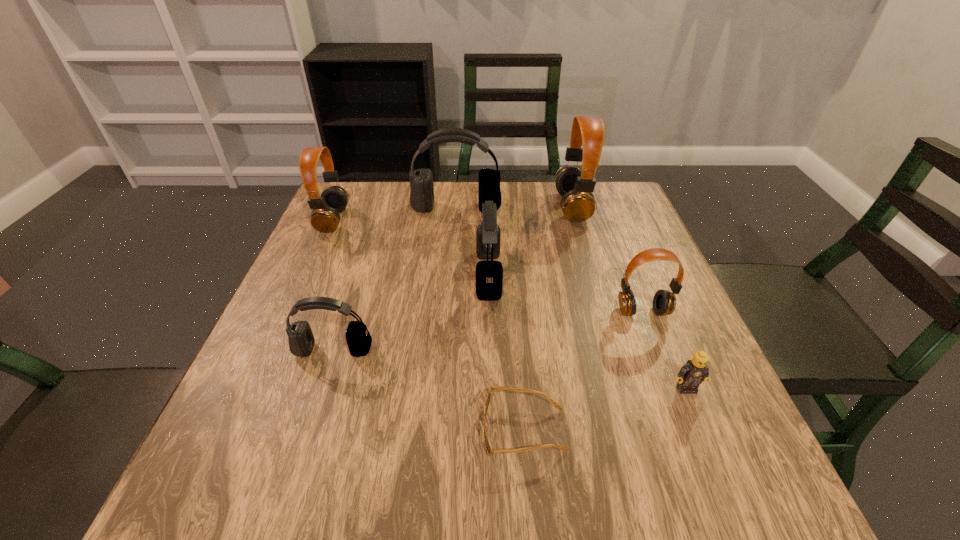
Locate an element on the screen. The height and width of the screenshot is (540, 960). free space at the far edge is located at coordinates (510, 187).

In the image, there is a desktop. Where is `blank space at the near edge`? blank space at the near edge is located at coordinates (574, 509).

In the image, there is a desktop. Find the location of `free space at the left edge`. free space at the left edge is located at coordinates (297, 279).

Locate an element on the screen. This screenshot has height=540, width=960. free region at the right edge is located at coordinates (693, 437).

Identify the location of free space at the far left corner of the desktop. (383, 191).

The image size is (960, 540). In the image, there is a desktop. What are the coordinates of `vacant space at the far right corner` in the screenshot? It's located at (627, 218).

You are a GUI agent. You are given a task and a screenshot of the screen. Output one action in this format:
    pyautogui.click(x=<x>, y=<y>)
    Task: Click on the empty space that is in between the shortest object and the second farthest black headset
    This screenshot has width=960, height=540.
    Given the screenshot: What is the action you would take?
    pyautogui.click(x=507, y=352)

The image size is (960, 540). Find the location of `vacant point located between the seventh farthest object and the farthest black headset`. vacant point located between the seventh farthest object and the farthest black headset is located at coordinates (571, 298).

At what (x,y) coordinates should I click in order to perform the action: click on vacant area that lies between the sunglasses and the leftmost headset. Please return your answer as a coordinate pair (x, y). This screenshot has height=540, width=960. Looking at the image, I should click on (429, 325).

Identify the location of free space between the seventh farthest object and the second smallest black headset. (588, 332).